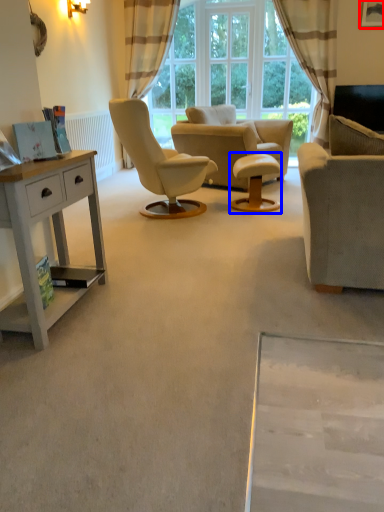
Question: Which point is further to the camera, picture frame (highlighted by a red box) or round table (highlighted by a blue box)?

Choices:
 (A) picture frame
 (B) round table

Answer: (A)